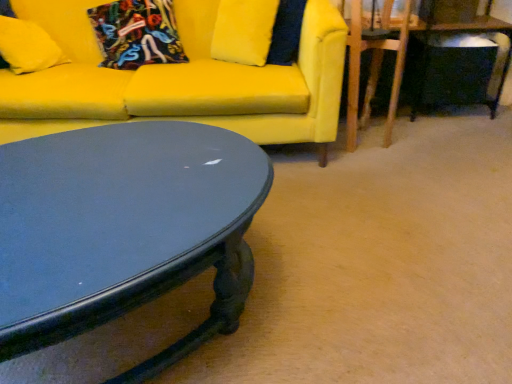
In order to face glossy dark wood coffee table at lower left, should I rotate leftwards or rightwards?

To align with it, rotate left about 16.349°.

Identify the location of matte yellow couch at upper left. (179, 80).

Find the location of a particular element. Image resolution: width=512 pixels, height=384 pixels. velvet floral pillow at upper left, placed as the 2th pillow when sorted from left to right is located at coordinates (137, 33).

This screenshot has height=384, width=512. In order to click on wooden swivel chair at right in this screenshot , I will do [372, 72].

This screenshot has width=512, height=384. I want to click on glossy dark wood coffee table at lower left, so click(124, 229).

Does matte yellow couch at upper left appear on the left side of matte black table at lower right?

Indeed, matte yellow couch at upper left is positioned on the left side of matte black table at lower right.

Which of these two, matte yellow couch at upper left or matte black table at lower right, is wider?

matte yellow couch at upper left is wider.

From the image's perspective, which is above, matte yellow couch at upper left or matte black table at lower right?

matte black table at lower right, from the image's perspective.

Would you say matte black table at lower right is to the left or to the right of velvet floral pillow at upper left, acting as the 1th pillow starting from the right, in the picture?

matte black table at lower right is positioned on velvet floral pillow at upper left, acting as the 1th pillow starting from the right,'s right side.

Image resolution: width=512 pixels, height=384 pixels. Find the location of `table below the velvet floral pillow at upper left, placed as the 2th pillow when sorted from left to right (from the image's perspective)`. table below the velvet floral pillow at upper left, placed as the 2th pillow when sorted from left to right (from the image's perspective) is located at coordinates (470, 31).

Based on the photo, is matte black table at lower right next to velvet floral pillow at upper left, acting as the 1th pillow starting from the right, and touching it?

No, matte black table at lower right is not with velvet floral pillow at upper left, acting as the 1th pillow starting from the right.

Is matte black table at lower right facing towards velvet floral pillow at upper left, acting as the 1th pillow starting from the right?

No, matte black table at lower right is not oriented towards velvet floral pillow at upper left, acting as the 1th pillow starting from the right.

Who is taller, glossy dark wood coffee table at lower left or matte yellow couch at upper left?

matte yellow couch at upper left.

Which object is further away from the camera, glossy dark wood coffee table at lower left or matte yellow couch at upper left?

matte yellow couch at upper left.

How many degrees apart are the facing directions of glossy dark wood coffee table at lower left and matte yellow couch at upper left?

The angular difference between glossy dark wood coffee table at lower left and matte yellow couch at upper left is 32.2 degrees.

From a real-world perspective, is glossy dark wood coffee table at lower left on top of matte yellow couch at upper left?

Actually, glossy dark wood coffee table at lower left is physically below matte yellow couch at upper left in the real world.

Considering the sizes of glossy dark wood coffee table at lower left and matte black table at lower right in the image, is glossy dark wood coffee table at lower left bigger or smaller than matte black table at lower right?

Considering their sizes, glossy dark wood coffee table at lower left takes up more space than matte black table at lower right.

From the image's perspective, is glossy dark wood coffee table at lower left above or below matte black table at lower right?

glossy dark wood coffee table at lower left is below matte black table at lower right.

Is glossy dark wood coffee table at lower left positioned beyond the bounds of matte black table at lower right?

Yes, glossy dark wood coffee table at lower left is not within matte black table at lower right.

Considering the sizes of objects glossy dark wood coffee table at lower left and matte black table at lower right in the image provided, who is wider, glossy dark wood coffee table at lower left or matte black table at lower right?

Wider between the two is glossy dark wood coffee table at lower left.

At what (x,y) coordinates should I click in order to perform the action: click on the 1st pillow behind the glossy dark wood coffee table at lower left. Please return your answer as a coordinate pair (x, y). The height and width of the screenshot is (384, 512). Looking at the image, I should click on (28, 46).

Between matte yellow pillow at upper left, marked as the 1th pillow in a left-to-right arrangement, and glossy dark wood coffee table at lower left, which one has larger size?

glossy dark wood coffee table at lower left is bigger.

Are matte yellow pillow at upper left, marked as the 1th pillow in a left-to-right arrangement, and glossy dark wood coffee table at lower left far apart?

Yes.

How much distance is there between matte yellow pillow at upper left, marked as the 1th pillow in a left-to-right arrangement, and glossy dark wood coffee table at lower left?

4.16 feet.

Looking at this image, from the image's perspective, is velvet floral pillow at upper left, acting as the 1th pillow starting from the right, located beneath wooden swivel chair at right?

Actually, velvet floral pillow at upper left, acting as the 1th pillow starting from the right, appears above wooden swivel chair at right in the image.

Considering the relative sizes of velvet floral pillow at upper left, acting as the 1th pillow starting from the right, and wooden swivel chair at right in the image provided, is velvet floral pillow at upper left, acting as the 1th pillow starting from the right, taller than wooden swivel chair at right?

Incorrect, the height of velvet floral pillow at upper left, acting as the 1th pillow starting from the right, is not larger of that of wooden swivel chair at right.

Is velvet floral pillow at upper left, placed as the 2th pillow when sorted from left to right, not within wooden swivel chair at right?

That's correct, velvet floral pillow at upper left, placed as the 2th pillow when sorted from left to right, is outside of wooden swivel chair at right.

How far apart are velvet floral pillow at upper left, acting as the 1th pillow starting from the right, and wooden swivel chair at right?

A distance of 1.09 meters exists between velvet floral pillow at upper left, acting as the 1th pillow starting from the right, and wooden swivel chair at right.

Based on the photo, how distant is matte black table at lower right from glossy dark wood coffee table at lower left?

1.96 meters.

Can you confirm if matte black table at lower right is thinner than glossy dark wood coffee table at lower left?

Correct, the width of matte black table at lower right is less than that of glossy dark wood coffee table at lower left.

You are a GUI agent. You are given a task and a screenshot of the screen. Output one action in this format:
    pyautogui.click(x=<x>, y=<y>)
    Task: Click on the table located behind the glossy dark wood coffee table at lower left
    
    Given the screenshot: What is the action you would take?
    pyautogui.click(x=470, y=31)

From a real-world perspective, is matte black table at lower right positioned above or below glossy dark wood coffee table at lower left?

Clearly, from a real-world perspective, matte black table at lower right is above glossy dark wood coffee table at lower left.

The image size is (512, 384). Find the location of `studio couch in front of the matte black table at lower right`. studio couch in front of the matte black table at lower right is located at coordinates (179, 80).

Locate an element on the screen. table on the right of velvet floral pillow at upper left, acting as the 1th pillow starting from the right is located at coordinates (470, 31).

From the image, which object appears to be nearer to glossy dark wood coffee table at lower left, matte black table at lower right or wooden swivel chair at right?

Among the two, wooden swivel chair at right is located nearer to glossy dark wood coffee table at lower left.

In the scene shown: When comparing their distances from velvet floral pillow at upper left, acting as the 1th pillow starting from the right, does glossy dark wood coffee table at lower left or matte black table at lower right seem further?

Among the two, matte black table at lower right is located further to velvet floral pillow at upper left, acting as the 1th pillow starting from the right.

When comparing their distances from matte yellow couch at upper left, does matte black table at lower right or wooden swivel chair at right seem further?

The object further to matte yellow couch at upper left is matte black table at lower right.

Which object lies nearer to the anchor point matte black table at lower right, velvet floral pillow at upper left, acting as the 1th pillow starting from the right, or matte yellow pillow at upper left, the second pillow positioned from the right?

Based on the image, velvet floral pillow at upper left, acting as the 1th pillow starting from the right, appears to be nearer to matte black table at lower right.

From the image, which object appears to be nearer to matte black table at lower right, matte yellow pillow at upper left, marked as the 1th pillow in a left-to-right arrangement, or wooden swivel chair at right?

The object closer to matte black table at lower right is wooden swivel chair at right.

From the image, which object appears to be farther from matte yellow pillow at upper left, marked as the 1th pillow in a left-to-right arrangement, velvet floral pillow at upper left, acting as the 1th pillow starting from the right, or matte black table at lower right?

Among the two, matte black table at lower right is located further to matte yellow pillow at upper left, marked as the 1th pillow in a left-to-right arrangement.

Estimate the real-world distances between objects in this image. Which object is closer to wooden swivel chair at right, matte yellow pillow at upper left, the second pillow positioned from the right, or matte black table at lower right?

matte black table at lower right is positioned closer to the anchor wooden swivel chair at right.

Considering their positions, is matte black table at lower right positioned further to matte yellow pillow at upper left, marked as the 1th pillow in a left-to-right arrangement, than glossy dark wood coffee table at lower left?

Based on the image, matte black table at lower right appears to be further to matte yellow pillow at upper left, marked as the 1th pillow in a left-to-right arrangement.

At what (x,y) coordinates should I click in order to perform the action: click on pillow between matte yellow pillow at upper left, the second pillow positioned from the right, and matte black table at lower right, in the horizontal direction. Please return your answer as a coordinate pair (x, y). Looking at the image, I should click on (137, 33).

Identify the location of pillow between matte yellow pillow at upper left, marked as the 1th pillow in a left-to-right arrangement, and wooden swivel chair at right from left to right. The image size is (512, 384). (137, 33).

Locate an element on the screen. The height and width of the screenshot is (384, 512). coffee table between matte yellow pillow at upper left, marked as the 1th pillow in a left-to-right arrangement, and matte black table at lower right from left to right is located at coordinates (124, 229).

The height and width of the screenshot is (384, 512). I want to click on coffee table situated between matte yellow couch at upper left and matte black table at lower right from left to right, so click(124, 229).